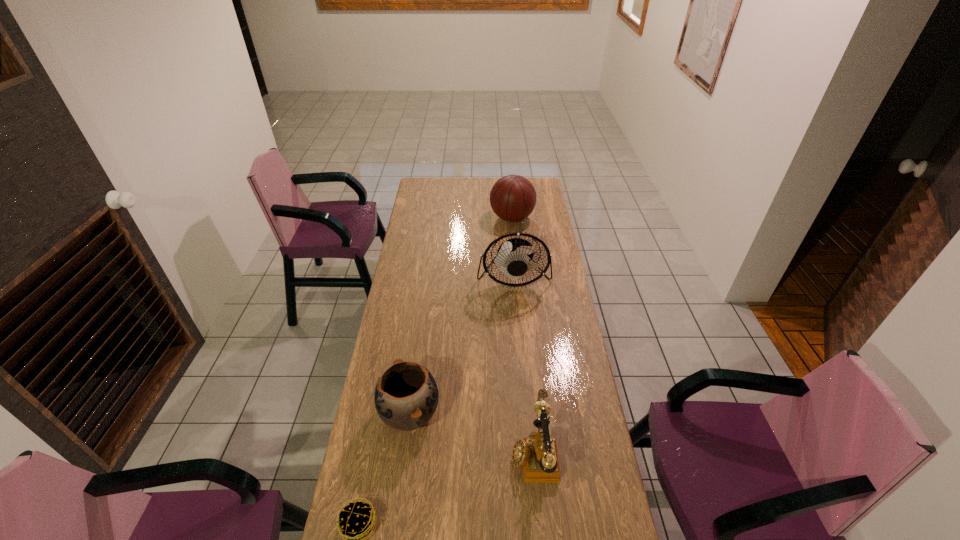
Where is `empty space between the fourth nearest object and the telephone`? The height and width of the screenshot is (540, 960). empty space between the fourth nearest object and the telephone is located at coordinates (524, 364).

This screenshot has width=960, height=540. In order to click on free space between the farthest object and the telephone in this screenshot , I will do `click(523, 335)`.

Choose which object is the second nearest neighbor to the shortest object. Please provide its 2D coordinates. Your answer should be formatted as a tuple, i.e. [(x, y)], where the tuple contains the x and y coordinates of a point satisfying the conditions above.

[(538, 456)]

Identify which object is located as the second nearest to the pottery. Please provide its 2D coordinates. Your answer should be formatted as a tuple, i.e. [(x, y)], where the tuple contains the x and y coordinates of a point satisfying the conditions above.

[(538, 456)]